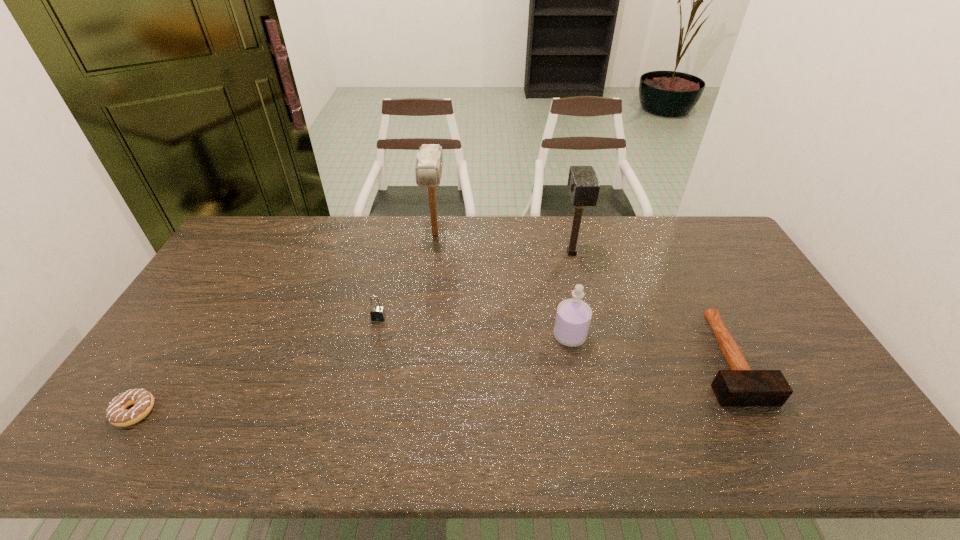
Where is `vacant area that satisfies the following two spatial constraints: 1. on the shackle of the padlock; 2. on the left side of the perfume`? Image resolution: width=960 pixels, height=540 pixels. vacant area that satisfies the following two spatial constraints: 1. on the shackle of the padlock; 2. on the left side of the perfume is located at coordinates (374, 336).